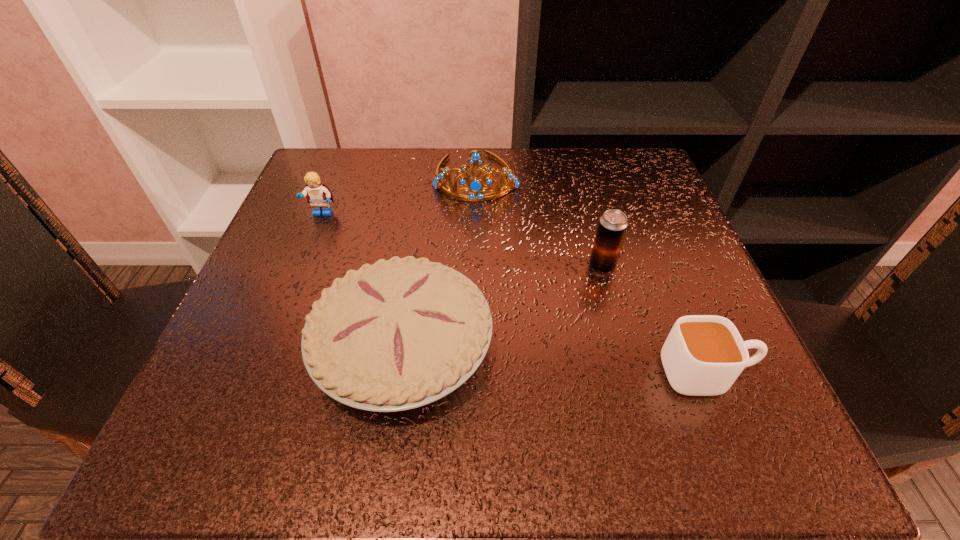
Find the location of `the farthest object`. the farthest object is located at coordinates (475, 186).

At what (x,y) coordinates should I click in order to perform the action: click on beer can. Please return your answer as a coordinate pair (x, y). Looking at the image, I should click on (613, 224).

Where is `the second object from right to left`? Image resolution: width=960 pixels, height=540 pixels. the second object from right to left is located at coordinates (613, 224).

Where is `the leftmost object`? the leftmost object is located at coordinates (318, 195).

Locate an element on the screen. Image resolution: width=960 pixels, height=540 pixels. the second farthest object is located at coordinates (318, 195).

You are a GUI agent. You are given a task and a screenshot of the screen. Output one action in this format:
    pyautogui.click(x=<x>, y=<y>)
    Task: Click on the pie
    The width and height of the screenshot is (960, 540).
    Given the screenshot: What is the action you would take?
    pyautogui.click(x=402, y=333)

Where is `the rightmost object`? the rightmost object is located at coordinates (703, 355).

Where is `vacant space positioned on the front-facing side of the farthest object`? The width and height of the screenshot is (960, 540). vacant space positioned on the front-facing side of the farthest object is located at coordinates (476, 222).

In order to click on vacant space located 0.340m on the left of the beer can in this screenshot , I will do `click(396, 266)`.

Identify the location of vacant space situated 0.350m on the front-facing side of the second farthest object. (256, 380).